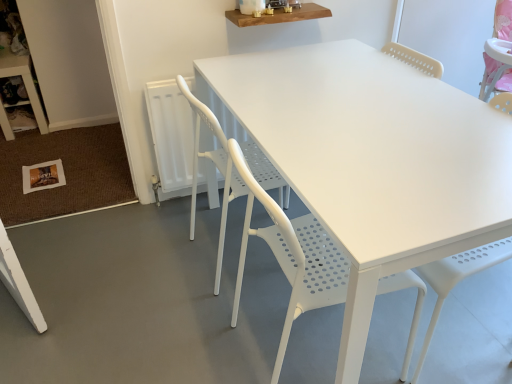
The width and height of the screenshot is (512, 384). Describe the element at coordinates (279, 16) in the screenshot. I see `wooden shelf at upper center, arranged as the second table when viewed from the back` at that location.

Locate an element on the screen. This screenshot has height=384, width=512. wooden shelf at upper center, arranged as the second table when viewed from the back is located at coordinates (279, 16).

Measure the distance between white perforated plastic chair at center, which is the 2th chair from back to front, and camera.

A distance of 34.04 inches exists between white perforated plastic chair at center, which is the 2th chair from back to front, and camera.

The height and width of the screenshot is (384, 512). What do you see at coordinates (272, 230) in the screenshot?
I see `white perforated plastic chair at center, which is the 2th chair from back to front` at bounding box center [272, 230].

Where is `wooden shelf at upper center, which is counted as the second table, starting from the left`? The image size is (512, 384). wooden shelf at upper center, which is counted as the second table, starting from the left is located at coordinates (279, 16).

Considering the positions of points (316, 298) and (37, 93), is point (316, 298) closer to camera compared to point (37, 93)?

That is True.

Considering the sizes of objects white perforated plastic chair at center, arranged as the first chair when viewed from the front, and white plastic table at lower left, placed as the 1th table when sorted from left to right, in the image provided, who is thinner, white perforated plastic chair at center, arranged as the first chair when viewed from the front, or white plastic table at lower left, placed as the 1th table when sorted from left to right,?

white plastic table at lower left, placed as the 1th table when sorted from left to right, is thinner.

From a real-world perspective, which object stands above the other?

white perforated plastic chair at center, arranged as the first chair when viewed from the front.

At what (x,y) coordinates should I click in order to perform the action: click on the 2nd chair below the white plastic table at lower left, placed as the 1th table when sorted from left to right (from the image's perspective). Please return your answer as a coordinate pair (x, y). Looking at the image, I should click on (272, 230).

Considering the relative sizes of white perforated plastic chair at center, which is the 2th chair from back to front, and white perforated plastic chair at center, marked as the second chair in a front-to-back arrangement, in the image provided, is white perforated plastic chair at center, which is the 2th chair from back to front, wider than white perforated plastic chair at center, marked as the second chair in a front-to-back arrangement,?

No, white perforated plastic chair at center, which is the 2th chair from back to front, is not wider than white perforated plastic chair at center, marked as the second chair in a front-to-back arrangement.

Is point (270, 174) closer or farther from the camera than point (194, 227)?

Point (270, 174) appears to be closer to the viewer than point (194, 227).

Is white perforated plastic chair at center, which is the 2th chair from back to front, placed right next to white perforated plastic chair at center, marked as the second chair in a front-to-back arrangement?

There is a gap between white perforated plastic chair at center, which is the 2th chair from back to front, and white perforated plastic chair at center, marked as the second chair in a front-to-back arrangement.

From the image's perspective, who appears lower, white plastic table at lower left, which appears as the 1th table when viewed from the back, or white perforated plastic chair at center, marked as the second chair in a front-to-back arrangement?

From the image's view, white perforated plastic chair at center, marked as the second chair in a front-to-back arrangement, is below.

Which object is wider, white plastic table at lower left, positioned as the second table in right-to-left order, or white perforated plastic chair at center, the first chair viewed from the back?

white perforated plastic chair at center, the first chair viewed from the back.

Is white plastic table at lower left, positioned as the second table in right-to-left order, to the right of white perforated plastic chair at center, marked as the second chair in a front-to-back arrangement, from the viewer's perspective?

Incorrect, white plastic table at lower left, positioned as the second table in right-to-left order, is not on the right side of white perforated plastic chair at center, marked as the second chair in a front-to-back arrangement.

Consider the image. Is white perforated plastic chair at center, the first chair viewed from the back, touching white plastic table at lower left, which appears as the 1th table when viewed from the back?

white perforated plastic chair at center, the first chair viewed from the back, is not next to white plastic table at lower left, which appears as the 1th table when viewed from the back, and they're not touching.

From the image's perspective, which is below, white perforated plastic chair at center, the first chair viewed from the back, or white plastic table at lower left, positioned as the second table in front-to-back order?

white perforated plastic chair at center, the first chair viewed from the back, appears lower in the image.

Would you consider wooden shelf at upper center, placed as the 1th table when sorted from front to back, to be distant from white plastic table at lower left, positioned as the second table in right-to-left order?

wooden shelf at upper center, placed as the 1th table when sorted from front to back, is positioned a significant distance from white plastic table at lower left, positioned as the second table in right-to-left order.

Considering the relative sizes of wooden shelf at upper center, which is counted as the second table, starting from the left, and white plastic table at lower left, placed as the 1th table when sorted from left to right, in the image provided, is wooden shelf at upper center, which is counted as the second table, starting from the left, shorter than white plastic table at lower left, placed as the 1th table when sorted from left to right,?

Yes, wooden shelf at upper center, which is counted as the second table, starting from the left, is shorter than white plastic table at lower left, placed as the 1th table when sorted from left to right.

Considering the points (314, 15) and (4, 130), which point is behind, point (314, 15) or point (4, 130)?

The point (4, 130) is farther from the camera.

This screenshot has height=384, width=512. Identify the location of table on the left side of wooden shelf at upper center, placed as the 1th table when sorted from front to back. tap(24, 83).

Is white plastic table at lower left, positioned as the second table in front-to-back order, looking in the opposite direction of wooden shelf at upper center, placed as the 1th table when sorted from front to back?

white plastic table at lower left, positioned as the second table in front-to-back order, does not have its back to wooden shelf at upper center, placed as the 1th table when sorted from front to back.

Does white plastic table at lower left, positioned as the second table in front-to-back order, appear on the right side of wooden shelf at upper center, which appears as the first table when viewed from the right?

Incorrect, white plastic table at lower left, positioned as the second table in front-to-back order, is not on the right side of wooden shelf at upper center, which appears as the first table when viewed from the right.

How many degrees apart are the facing directions of white plastic table at lower left, positioned as the second table in front-to-back order, and wooden shelf at upper center, placed as the 1th table when sorted from front to back?

The angle between the facing direction of white plastic table at lower left, positioned as the second table in front-to-back order, and the facing direction of wooden shelf at upper center, placed as the 1th table when sorted from front to back, is 89.9 degrees.

Considering the sizes of objects white plastic table at lower left, positioned as the second table in front-to-back order, and wooden shelf at upper center, which is counted as the second table, starting from the left, in the image provided, who is taller, white plastic table at lower left, positioned as the second table in front-to-back order, or wooden shelf at upper center, which is counted as the second table, starting from the left,?

white plastic table at lower left, positioned as the second table in front-to-back order, is taller.

Considering the sizes of white perforated plastic chair at center, the first chair viewed from the back, and white perforated plastic chair at center, arranged as the first chair when viewed from the front, in the image, is white perforated plastic chair at center, the first chair viewed from the back, bigger or smaller than white perforated plastic chair at center, arranged as the first chair when viewed from the front,?

Clearly, white perforated plastic chair at center, the first chair viewed from the back, is larger in size than white perforated plastic chair at center, arranged as the first chair when viewed from the front.

Is white perforated plastic chair at center, the first chair viewed from the back, taller than white perforated plastic chair at center, arranged as the first chair when viewed from the front?

Correct, white perforated plastic chair at center, the first chair viewed from the back, is much taller as white perforated plastic chair at center, arranged as the first chair when viewed from the front.

Is white perforated plastic chair at center, marked as the second chair in a front-to-back arrangement, situated inside white perforated plastic chair at center, arranged as the first chair when viewed from the front, or outside?

white perforated plastic chair at center, marked as the second chair in a front-to-back arrangement, exists outside the volume of white perforated plastic chair at center, arranged as the first chair when viewed from the front.

Considering the relative positions of white perforated plastic chair at center, marked as the second chair in a front-to-back arrangement, and white perforated plastic chair at center, arranged as the first chair when viewed from the front, in the image provided, is white perforated plastic chair at center, marked as the second chair in a front-to-back arrangement, to the left or to the right of white perforated plastic chair at center, arranged as the first chair when viewed from the front,?

white perforated plastic chair at center, marked as the second chair in a front-to-back arrangement, is to the left of white perforated plastic chair at center, arranged as the first chair when viewed from the front.

In order to click on table that is the 1st one when counting upward from the white perforated plastic chair at center, which is the 2th chair from back to front (from the image's perspective) in this screenshot , I will do `click(24, 83)`.

This screenshot has height=384, width=512. I want to click on chair below the white perforated plastic chair at center, marked as the second chair in a front-to-back arrangement (from the image's perspective), so click(272, 230).

Based on their spatial positions, is white perforated plastic chair at center, the first chair viewed from the back, or white plastic table at lower left, which appears as the 1th table when viewed from the back, closer to wooden shelf at upper center, which appears as the first table when viewed from the right?

The object closer to wooden shelf at upper center, which appears as the first table when viewed from the right, is white perforated plastic chair at center, the first chair viewed from the back.

Based on their spatial positions, is white plastic table at lower left, positioned as the second table in front-to-back order, or white perforated plastic chair at center, marked as the second chair in a front-to-back arrangement, further from wooden shelf at upper center, which appears as the first table when viewed from the right?

white plastic table at lower left, positioned as the second table in front-to-back order, lies further to wooden shelf at upper center, which appears as the first table when viewed from the right, than the other object.

Based on their spatial positions, is white plastic table at lower left, placed as the 1th table when sorted from left to right, or white perforated plastic chair at center, arranged as the first chair when viewed from the front, further from white perforated plastic chair at center, marked as the second chair in a front-to-back arrangement?

white plastic table at lower left, placed as the 1th table when sorted from left to right.

Considering their positions, is white perforated plastic chair at center, which is the 2th chair from back to front, positioned closer to wooden shelf at upper center, which appears as the first table when viewed from the right, than white perforated plastic chair at center, the first chair viewed from the back?

The object closer to wooden shelf at upper center, which appears as the first table when viewed from the right, is white perforated plastic chair at center, the first chair viewed from the back.

Looking at the image, which one is located further to white plastic table at lower left, which appears as the 1th table when viewed from the back, wooden shelf at upper center, which appears as the first table when viewed from the right, or white perforated plastic chair at center, arranged as the first chair when viewed from the front?

white perforated plastic chair at center, arranged as the first chair when viewed from the front, lies further to white plastic table at lower left, which appears as the 1th table when viewed from the back, than the other object.

When comparing their distances from wooden shelf at upper center, arranged as the second table when viewed from the back, does white perforated plastic chair at center, arranged as the first chair when viewed from the front, or white plastic table at lower left, which appears as the 1th table when viewed from the back, seem closer?

white perforated plastic chair at center, arranged as the first chair when viewed from the front, lies closer to wooden shelf at upper center, arranged as the second table when viewed from the back, than the other object.

Estimate the real-world distances between objects in this image. Which object is closer to white plastic table at lower left, placed as the 1th table when sorted from left to right, wooden shelf at upper center, arranged as the second table when viewed from the back, or white perforated plastic chair at center, marked as the second chair in a front-to-back arrangement?

wooden shelf at upper center, arranged as the second table when viewed from the back, is closer to white plastic table at lower left, placed as the 1th table when sorted from left to right.

Based on the photo, which object lies nearer to the anchor point white perforated plastic chair at center, arranged as the first chair when viewed from the front, wooden shelf at upper center, which appears as the first table when viewed from the right, or white perforated plastic chair at center, marked as the second chair in a front-to-back arrangement?

white perforated plastic chair at center, marked as the second chair in a front-to-back arrangement, is positioned closer to the anchor white perforated plastic chair at center, arranged as the first chair when viewed from the front.

You are a GUI agent. You are given a task and a screenshot of the screen. Output one action in this format:
    pyautogui.click(x=<x>, y=<y>)
    Task: Click on the chair located between white plastic table at lower left, positioned as the second table in right-to-left order, and white perforated plastic chair at center, which is the 2th chair from back to front, in the left-right direction
    The image size is (512, 384).
    Given the screenshot: What is the action you would take?
    pyautogui.click(x=199, y=143)

Image resolution: width=512 pixels, height=384 pixels. I want to click on chair between wooden shelf at upper center, placed as the 1th table when sorted from front to back, and white perforated plastic chair at center, which is the 2th chair from back to front, vertically, so click(x=199, y=143).

At what (x,y) coordinates should I click in order to perform the action: click on chair located between white plastic table at lower left, placed as the 1th table when sorted from left to right, and wooden shelf at upper center, arranged as the second table when viewed from the back, in the left-right direction. Please return your answer as a coordinate pair (x, y). The image size is (512, 384). Looking at the image, I should click on (199, 143).

Identify the location of table located between white plastic table at lower left, which appears as the 1th table when viewed from the back, and white perforated plastic chair at center, arranged as the first chair when viewed from the front, in the left-right direction. The width and height of the screenshot is (512, 384). (279, 16).